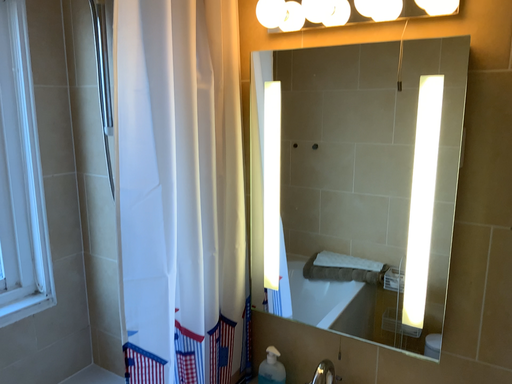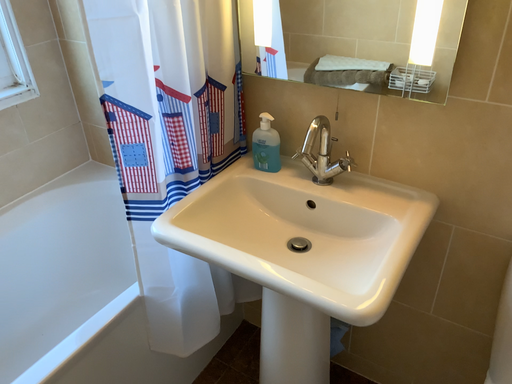
Question: Which way did the camera rotate in the video?

Choices:
 (A) rotated downward
 (B) rotated upward

Answer: (A)